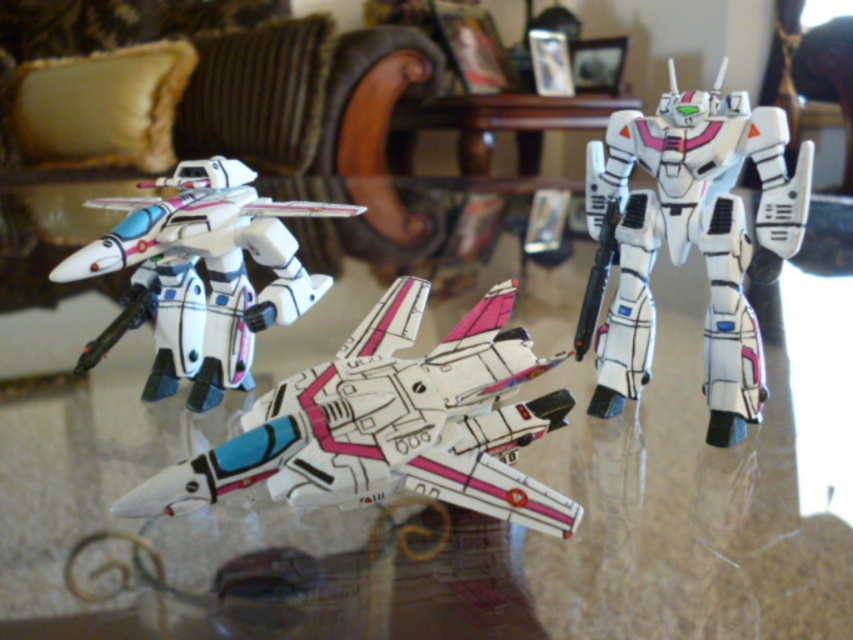
Question: Which point is closer to the camera?

Choices:
 (A) white matte robot at center
 (B) transparent glass table at center

Answer: (B)

Question: Is transparent glass table at center wider than white matte robot at center?

Choices:
 (A) no
 (B) yes

Answer: (B)

Question: Which point is closer to the camera taking this photo?

Choices:
 (A) click(90, 268)
 (B) click(416, 636)
 (C) click(343, 429)
 (D) click(747, 113)

Answer: (B)

Question: Which object is closer to the camera taking this photo?

Choices:
 (A) transparent glass table at center
 (B) white glossy robot at left
 (C) white matte robot at center
 (D) white glossy plane at center

Answer: (D)

Question: Is transparent glass table at center behind white glossy plane at center?

Choices:
 (A) yes
 (B) no

Answer: (A)

Question: Is white matte robot at center above white glossy robot at left?

Choices:
 (A) no
 (B) yes

Answer: (B)